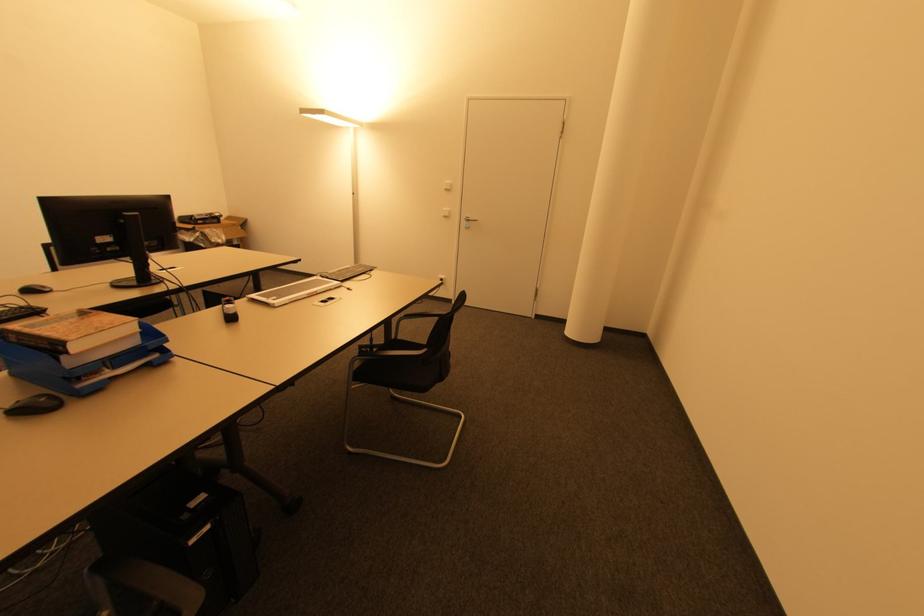
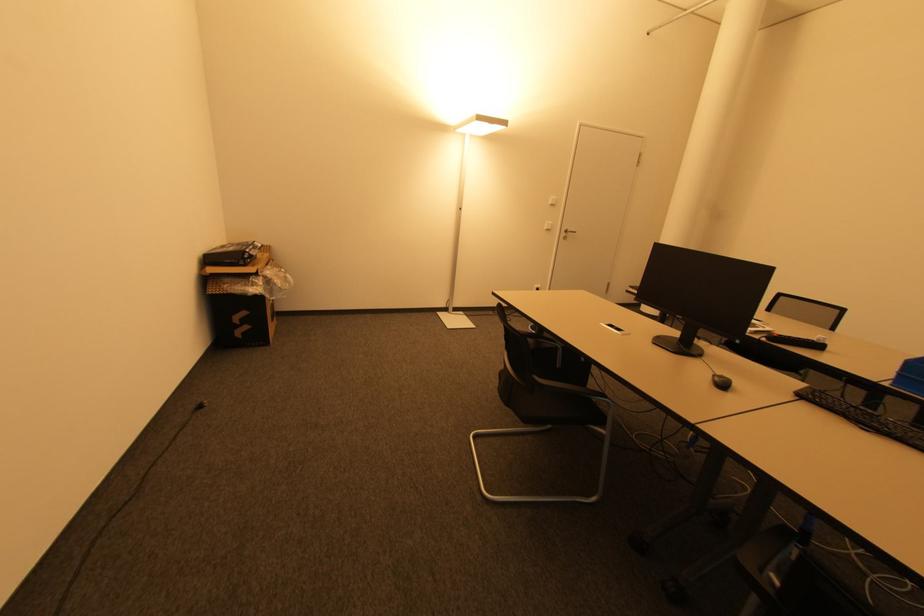
Locate, in the second image, the point that corresponds to the point at 202,223 in the first image.

(250, 261)